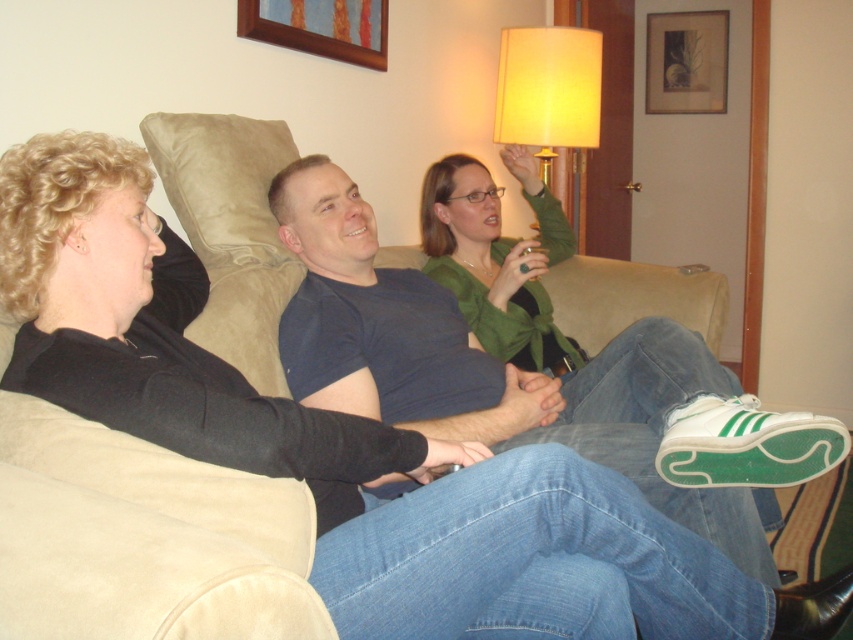
Looking at this image, you are standing in the living room and want to place a new decorative item on the couch. The couch has a coordinate system where the bottom left corner is the origin. The blue cotton t shirt at center is located at point (x=483, y=364). If you want to place the decorative item 0.1 units to the right and 0.05 units above the blue cotton t shirt at center, what are the coordinates of the new position?

The new coordinates would be calculated by adding 0.1 to the x coordinate and 0.05 to the y coordinate of the blue cotton t shirt at center. The original coordinates are (x=483, y=364). Adding 0.1 to the x gives 0.669, and adding 0.05 to the y gives 0.617. Therefore, the new position is at point 0.669, 0.617.